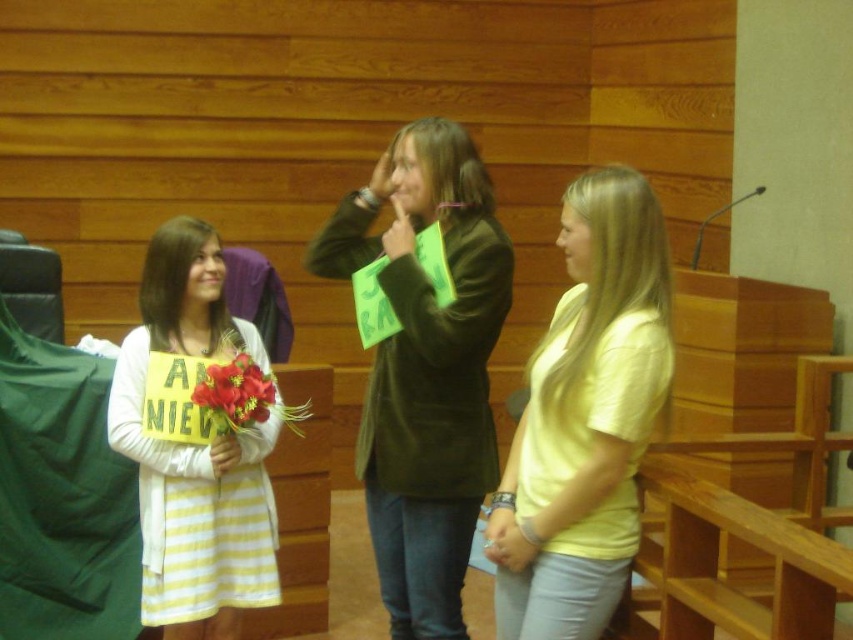
Question: Is yellow striped dress at left bigger than red silk flower at center?

Choices:
 (A) no
 (B) yes

Answer: (B)

Question: Can you confirm if matte green sign at center is positioned above yellow matte shirt at center?

Choices:
 (A) yes
 (B) no

Answer: (A)

Question: Estimate the real-world distances between objects in this image. Which object is closer to the red silk flower at center?

Choices:
 (A) yellow striped dress at left
 (B) yellow matte shirt at center

Answer: (A)

Question: Which point appears closest to the camera in this image?

Choices:
 (A) (523, 458)
 (B) (412, 436)
 (C) (262, 513)

Answer: (A)

Question: Is yellow matte shirt at center positioned behind red silk flower at center?

Choices:
 (A) yes
 (B) no

Answer: (B)

Question: Which object appears farthest from the camera in this image?

Choices:
 (A) yellow striped dress at left
 (B) yellow matte shirt at center
 (C) red silk flower at center
 (D) matte green sign at center

Answer: (A)